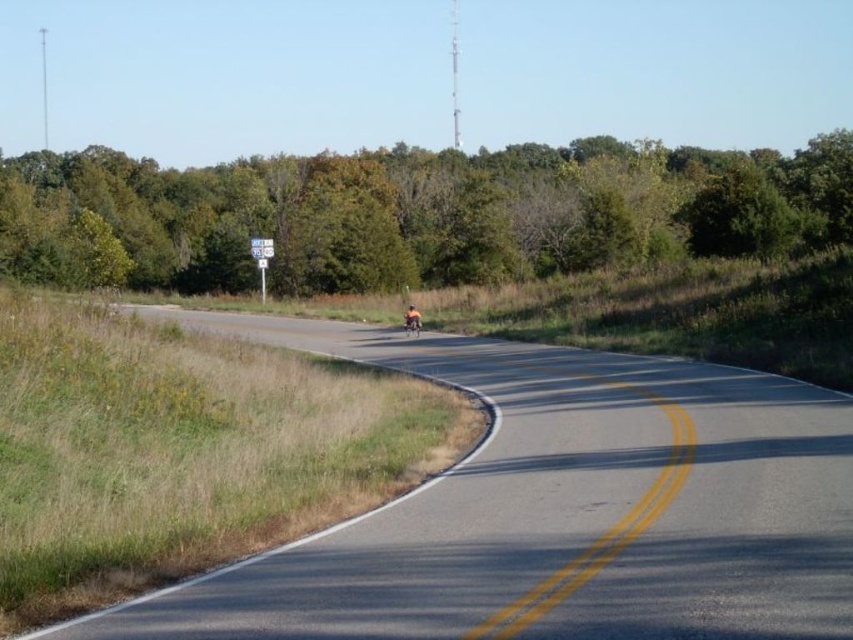
Question: Which of the following is the farthest from the observer?

Choices:
 (A) asphalt road at center
 (B) orange fabric motorcyclist at center

Answer: (B)

Question: Among these points, which one is nearest to the camera?

Choices:
 (A) (461, 493)
 (B) (407, 328)

Answer: (A)

Question: Which point is closer to the camera?

Choices:
 (A) green leafy trees at upper center
 (B) orange fabric motorcyclist at center
 (C) shiny chrome motorbike at center

Answer: (C)

Question: Is green leafy trees at upper center closer to camera compared to orange fabric motorcyclist at center?

Choices:
 (A) no
 (B) yes

Answer: (A)

Question: Is orange fabric motorcyclist at center to the right of shiny chrome motorbike at center from the viewer's perspective?

Choices:
 (A) yes
 (B) no

Answer: (B)

Question: Is asphalt road at center to the right of orange fabric motorcyclist at center from the viewer's perspective?

Choices:
 (A) no
 (B) yes

Answer: (B)